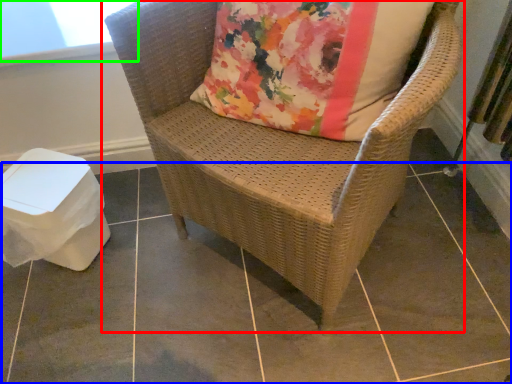
Question: Estimate the real-world distances between objects in this image. Which object is farther from chair (highlighted by a red box), tile (highlighted by a blue box) or window screen (highlighted by a green box)?

Choices:
 (A) tile
 (B) window screen

Answer: (B)